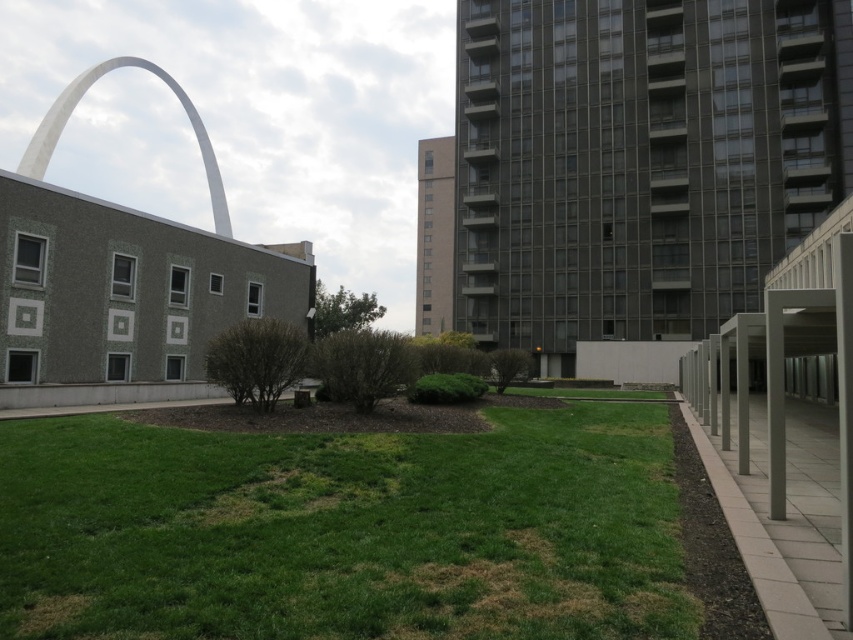
Question: From the image, what is the correct spatial relationship of green grass at center in relation to white smooth arch at upper left?

Choices:
 (A) below
 (B) above

Answer: (A)

Question: Which object is farther from the camera taking this photo?

Choices:
 (A) white smooth arch at upper left
 (B) green grass at center

Answer: (A)

Question: Which of the following is the farthest from the observer?

Choices:
 (A) white smooth arch at upper left
 (B) green grass at center

Answer: (A)

Question: Does green grass at center have a larger size compared to white smooth arch at upper left?

Choices:
 (A) no
 (B) yes

Answer: (A)

Question: Is green grass at center behind white smooth arch at upper left?

Choices:
 (A) no
 (B) yes

Answer: (A)